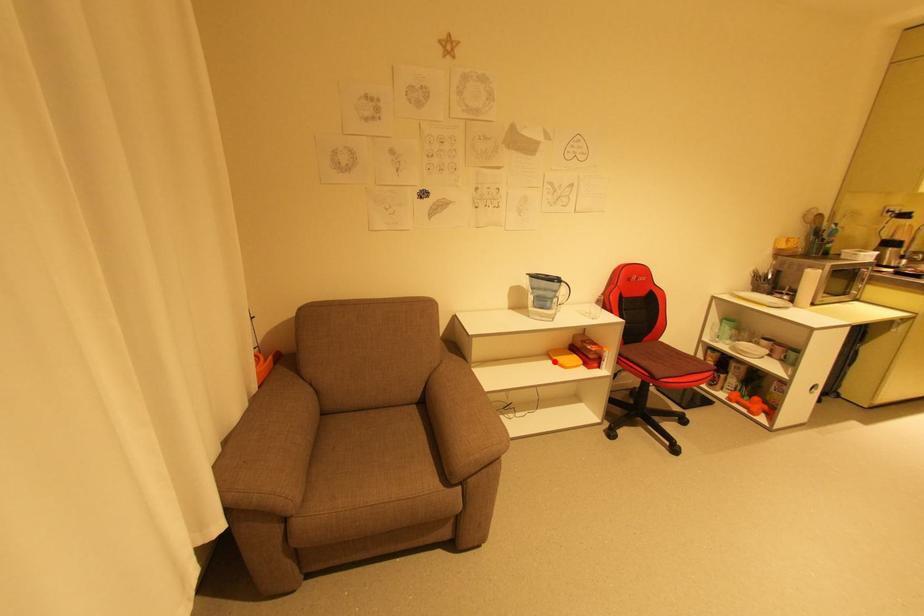
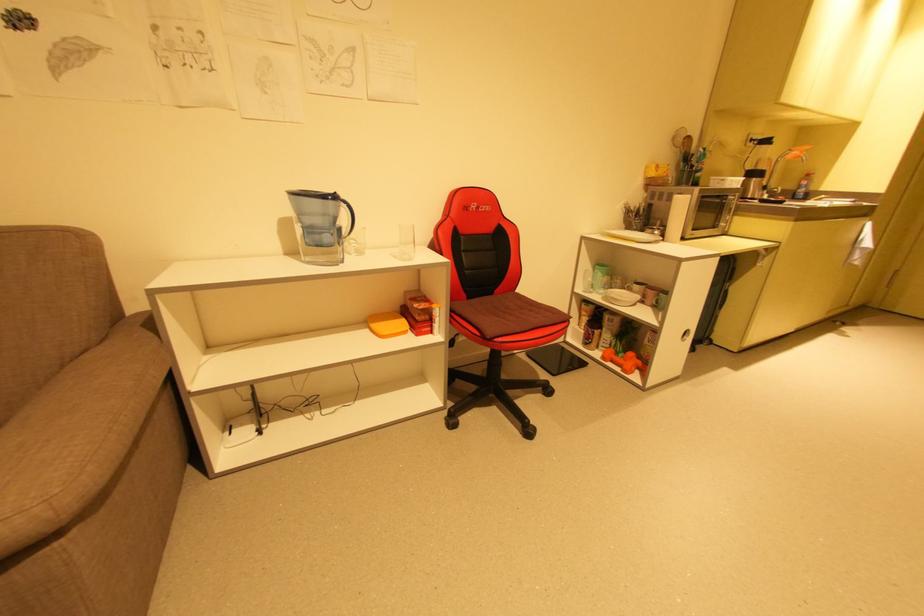
In the second image, find the point that corresponds to the highlighted location in the first image.

(371, 331)